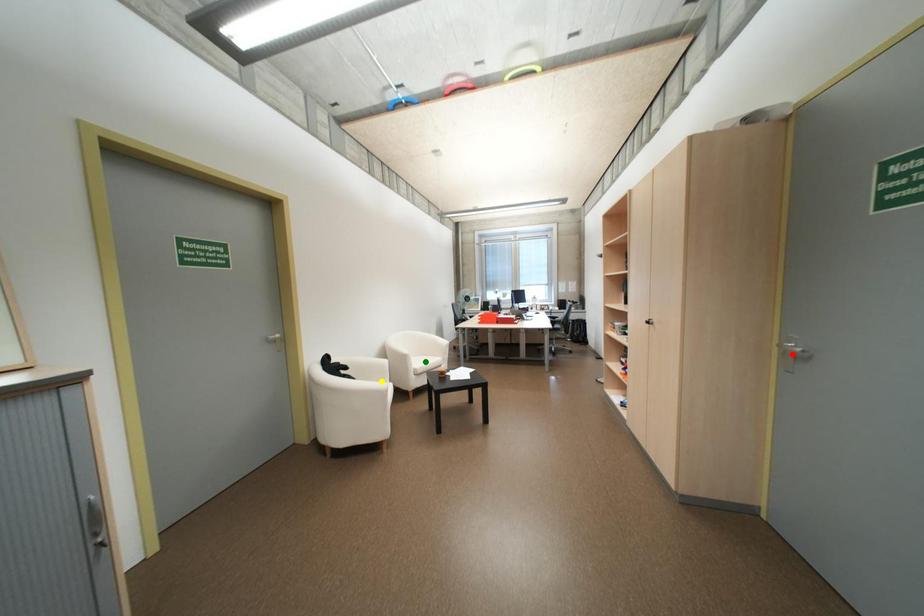
Order these from nearest to farthest:
A) red point
B) green point
C) yellow point

red point → yellow point → green point